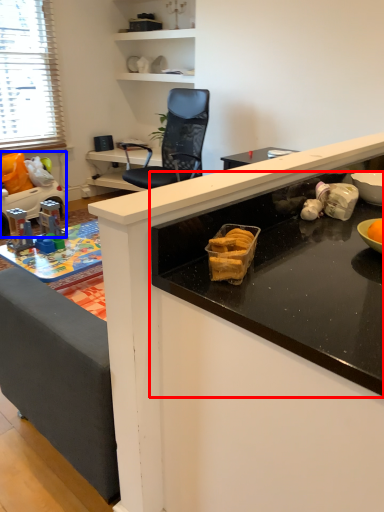
Question: Which point is further to the camera, countertop (highlighted by a red box) or toy (highlighted by a blue box)?

Choices:
 (A) countertop
 (B) toy

Answer: (B)